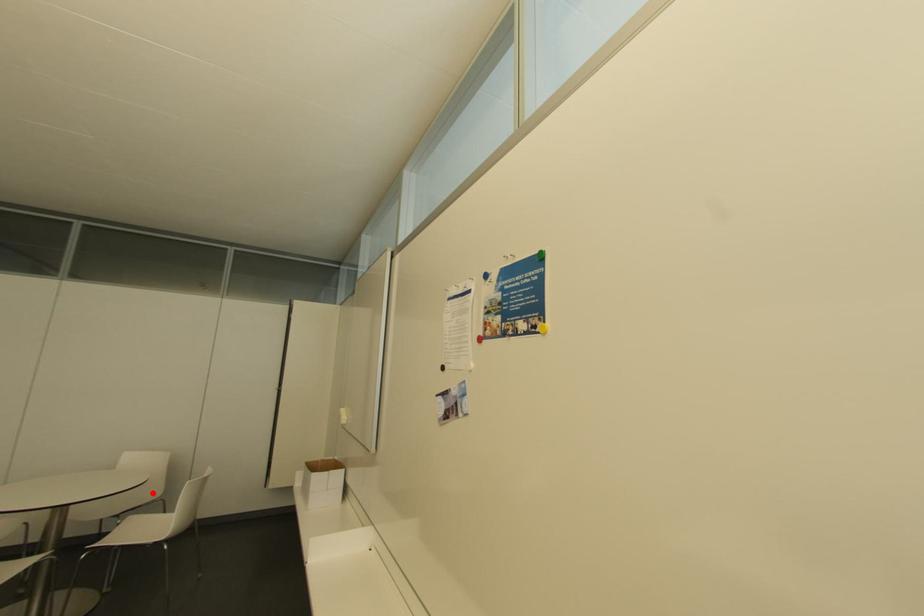
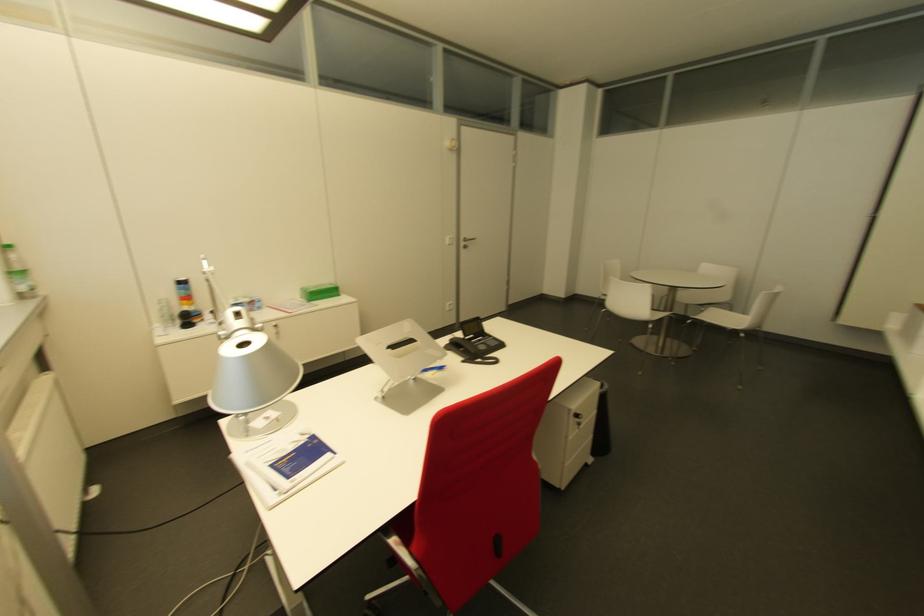
The point at the highlighted location is marked in the first image. Where is the corresponding point in the second image?

(722, 298)